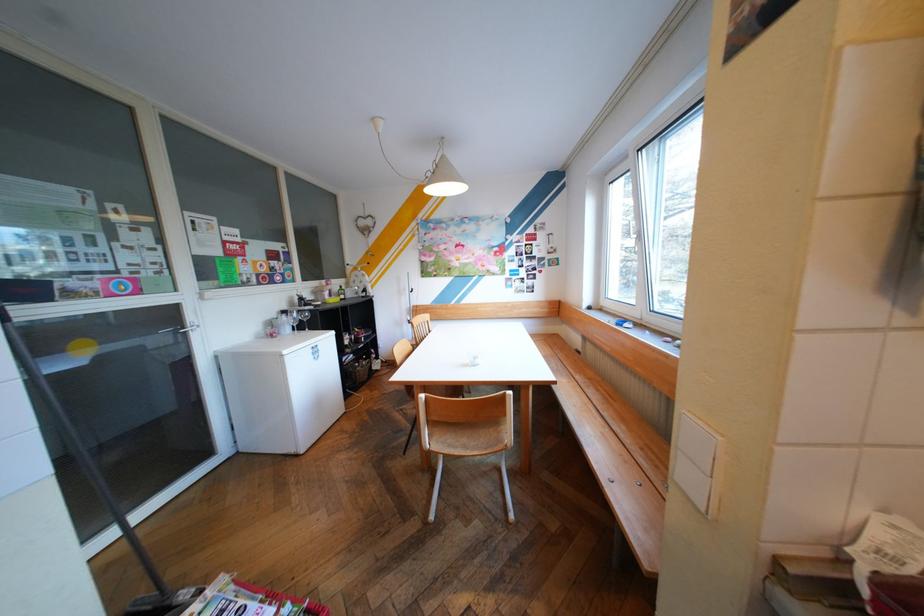
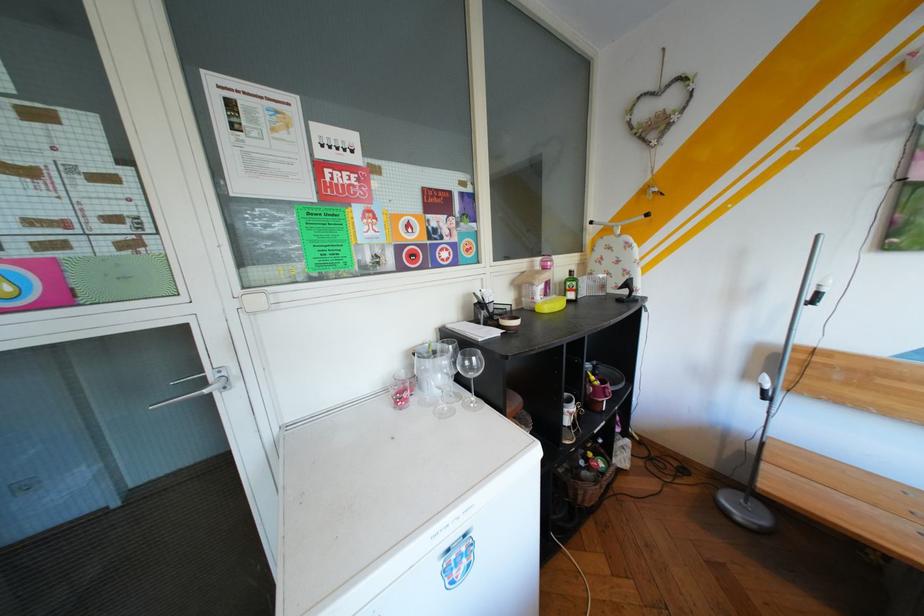
In the second image, find the point that corresponds to (321,304) in the first image.

(505, 320)